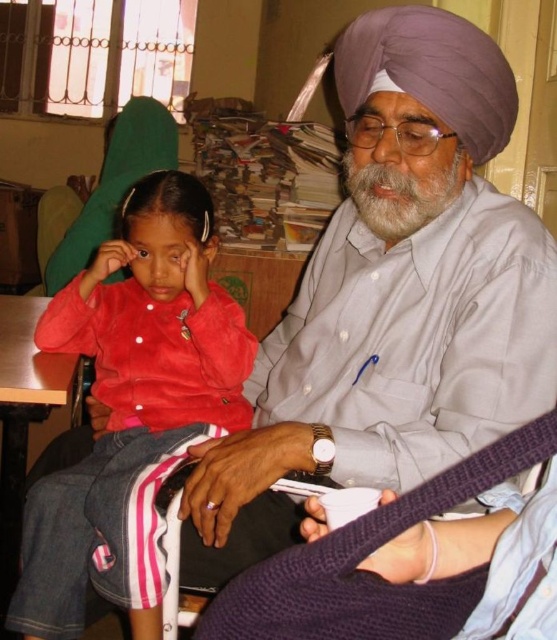
Does matte red shirt at left appear over purple silk turban at upper center?

No, matte red shirt at left is not above purple silk turban at upper center.

Is point (178, 300) more distant than point (419, 20)?

Yes.

Locate an element on the screen. matte red shirt at left is located at coordinates (133, 406).